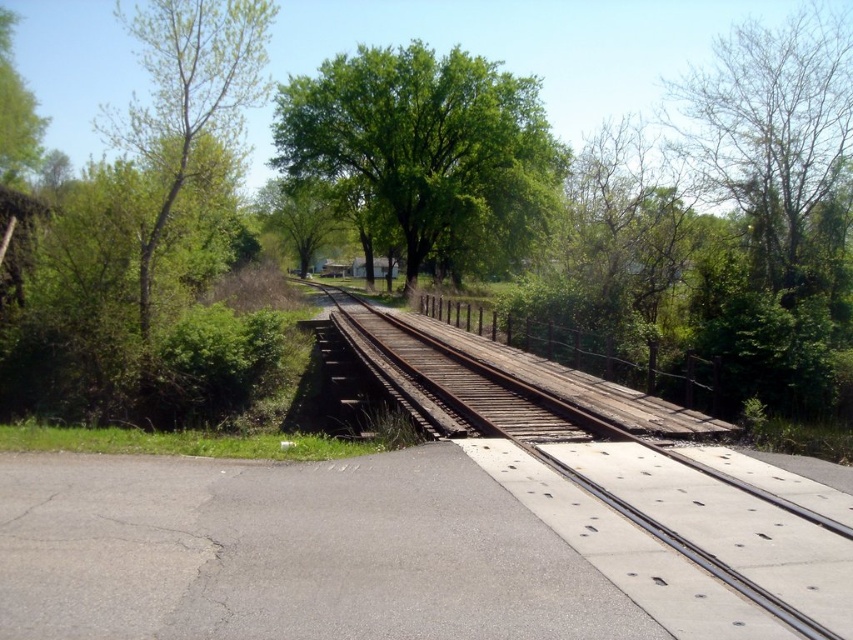
Question: Which object is positioned farthest from the rusty metal train track at center?

Choices:
 (A) green leafy tree at upper center
 (B) green leafy tree at left

Answer: (A)

Question: From the image, what is the correct spatial relationship of rusty metal train track at center in relation to green leafy tree at left?

Choices:
 (A) left
 (B) right

Answer: (B)

Question: Which of the following is the closest to the observer?

Choices:
 (A) green leafy tree at center
 (B) green leafy tree at upper center

Answer: (B)

Question: Can you confirm if green leafy tree at upper center is bigger than green leafy tree at upper left?

Choices:
 (A) yes
 (B) no

Answer: (A)

Question: Is bare wood tree at upper right positioned at the back of green leafy tree at center?

Choices:
 (A) no
 (B) yes

Answer: (A)

Question: Based on their relative distances, which object is nearer to the green leafy tree at upper left?

Choices:
 (A) green leafy tree at center
 (B) rusty metal train track at center
 (C) green leafy tree at left

Answer: (A)